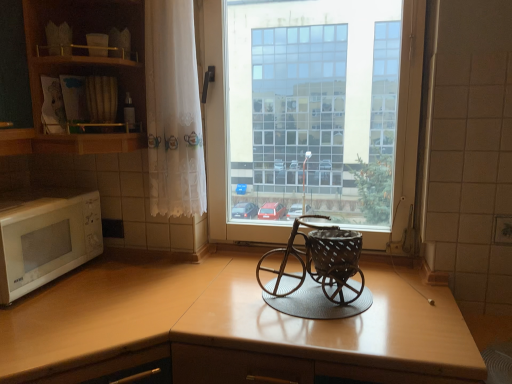
This screenshot has width=512, height=384. Identify the location of free point above light brown laminate counter top at left (from a real-world perspective). 93,297.